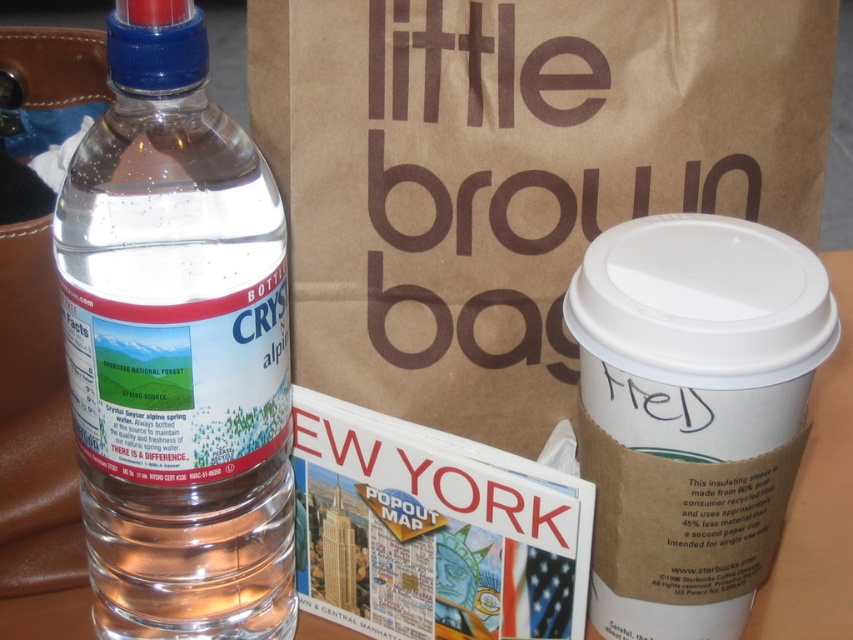
Who is taller, brown paper bag at upper center or white paper cup at right?

With more height is brown paper bag at upper center.

Can you confirm if brown paper bag at upper center is positioned to the right of white paper cup at right?

Incorrect, brown paper bag at upper center is not on the right side of white paper cup at right.

You are a GUI agent. You are given a task and a screenshot of the screen. Output one action in this format:
    pyautogui.click(x=<x>, y=<y>)
    Task: Click on the brown paper bag at upper center
    
    Given the screenshot: What is the action you would take?
    pyautogui.click(x=511, y=173)

What do you see at coordinates (178, 348) in the screenshot? The image size is (853, 640). I see `transparent plastic bottle at left` at bounding box center [178, 348].

Does transparent plastic bottle at left come behind white paper cup at right?

That is False.

The width and height of the screenshot is (853, 640). What do you see at coordinates (178, 348) in the screenshot?
I see `transparent plastic bottle at left` at bounding box center [178, 348].

Find the location of a particular element. The width and height of the screenshot is (853, 640). transparent plastic bottle at left is located at coordinates (178, 348).

How far apart are brown paper bag at upper center and transparent plastic bottle at left?

brown paper bag at upper center is 8.41 inches away from transparent plastic bottle at left.

Can you confirm if brown paper bag at upper center is positioned above transparent plastic bottle at left?

Correct, brown paper bag at upper center is located above transparent plastic bottle at left.

The image size is (853, 640). In order to click on brown paper bag at upper center in this screenshot , I will do `click(511, 173)`.

Identify the location of brown paper bag at upper center. Image resolution: width=853 pixels, height=640 pixels. (511, 173).